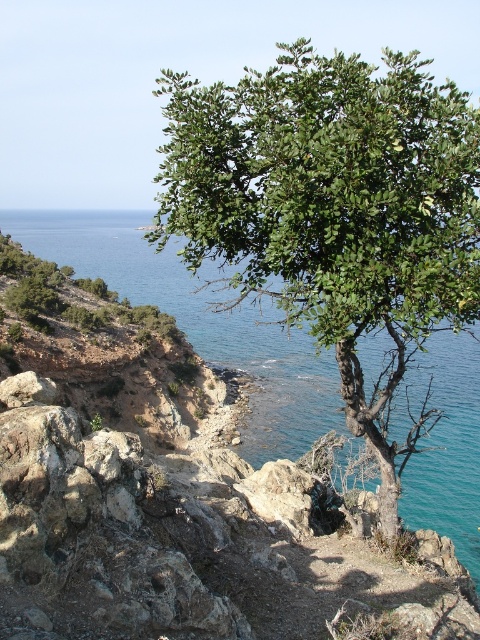
You are a hiker who wants to cross from the green leafy tree at upper center to the clear blue water at upper right. Given that your average walking pace is 1.5 meters per second, how many seconds will it take you to reach the water?

The distance between the green leafy tree at upper center and the clear blue water at upper right is 65.57 meters. At a walking pace of 1.5 meters per second, it would take approximately 43.7 seconds to reach the water.

You are standing at the point closer to the camera in the image. Which point are you at, point [432,83] or point [310,397]?

You are at point [432,83] because it is further to the camera than point [310,397].

You are planning to build a small garden in the coastal area shown in the image. You have two options for plants based on the existing green leafy tree at upper center and clear blue water at upper right. Which plant option would you choose if you want a plant that takes up more horizontal space?

The clear blue water at upper right would take up more horizontal space since the green leafy tree at upper center is narrower than it.